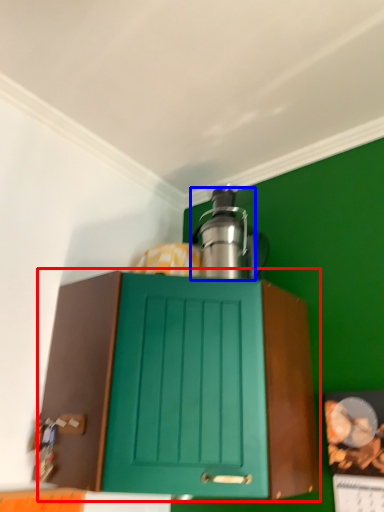
Question: Which object appears farthest to the camera in this image, cabinetry (highlighted by a red box) or kitchen appliance (highlighted by a blue box)?

Choices:
 (A) cabinetry
 (B) kitchen appliance

Answer: (B)